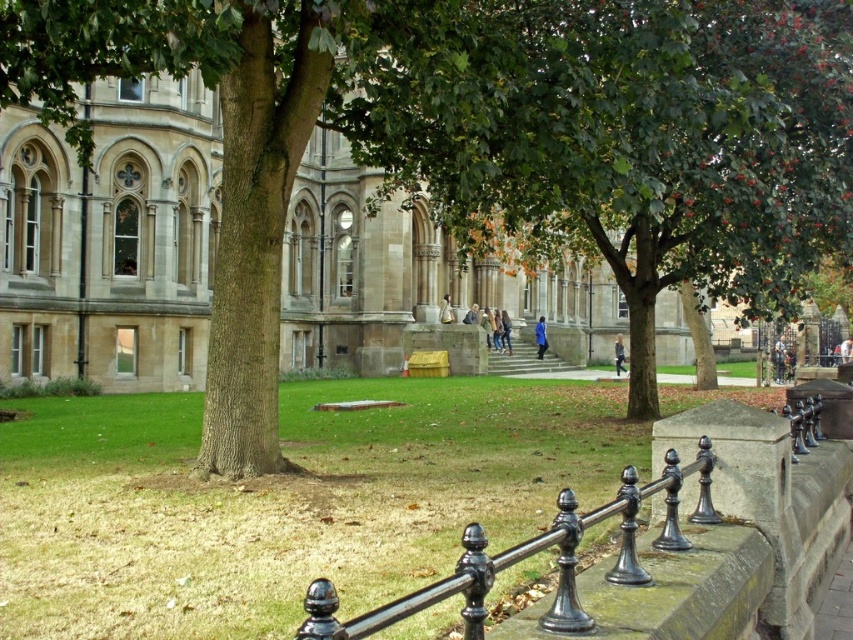
You are a visitor walking along the black polished metal rail at lower center and want to take a photo of the green leafy tree at center. Will the tree be fully visible in your photo without any obstructions?

The green leafy tree at center is positioned over the black polished metal rail at lower center, so part of the tree may be visible above the rail, but the lower part near the rail might be obstructed by the rail itself.